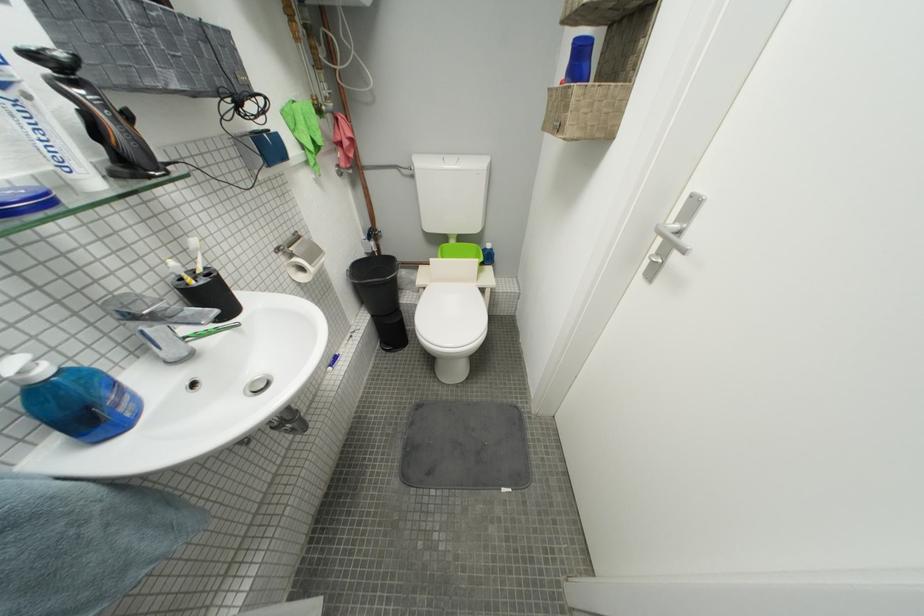
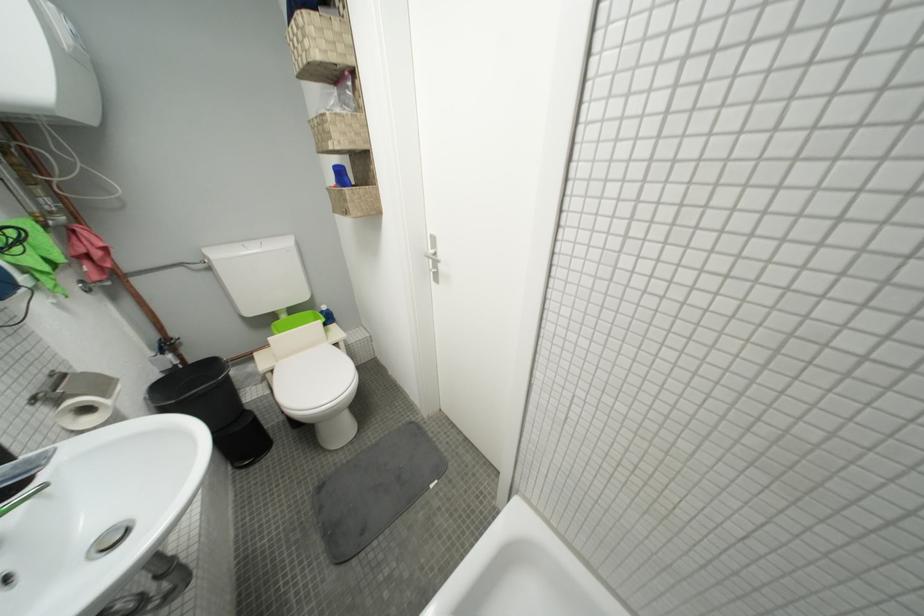
In the second image, find the point that corresponds to the point at 670,237 in the first image.

(438, 261)